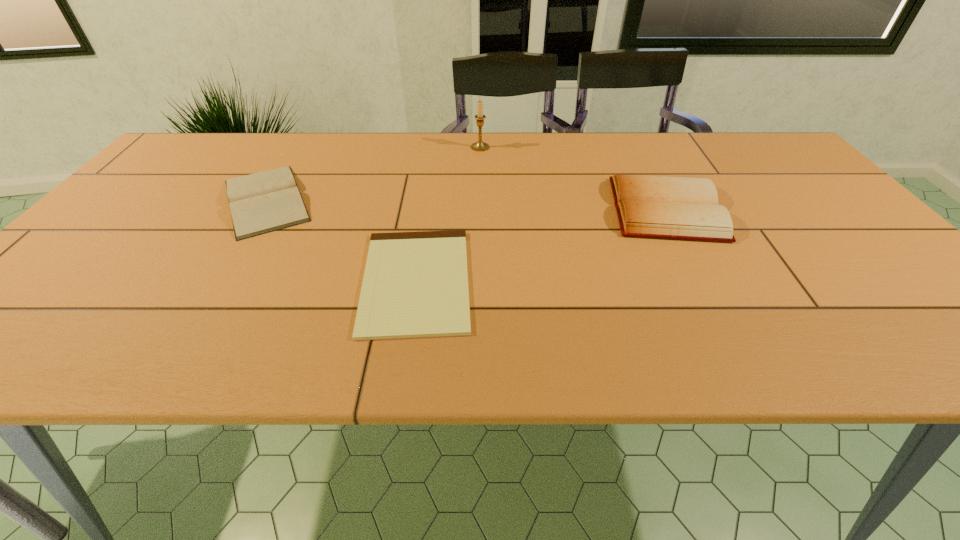
This screenshot has width=960, height=540. I want to click on blank region between the left Bible and the tallest object, so click(373, 174).

Locate an element on the screen. free space between the shortest object and the tallest object is located at coordinates (448, 214).

Where is `free space between the shortest object and the farthest object`? free space between the shortest object and the farthest object is located at coordinates (448, 214).

Image resolution: width=960 pixels, height=540 pixels. In order to click on blank region between the candle holder and the leftmost object in this screenshot , I will do `click(373, 174)`.

Identify the location of blank region between the leftmost object and the clipboard. (341, 240).

You are a GUI agent. You are given a task and a screenshot of the screen. Output one action in this format:
    pyautogui.click(x=<x>, y=<y>)
    Task: Click on the vacant area between the right Bible and the shortest object
    The width and height of the screenshot is (960, 540).
    Given the screenshot: What is the action you would take?
    pyautogui.click(x=541, y=245)

Locate an element on the screen. The height and width of the screenshot is (540, 960). vacant space in between the shorter Bible and the right Bible is located at coordinates (466, 205).

Find the location of `vacant region between the left Bible and the candle holder`. vacant region between the left Bible and the candle holder is located at coordinates (373, 174).

Where is `vacant area that lies between the clipboard and the third tallest object`? This screenshot has height=540, width=960. vacant area that lies between the clipboard and the third tallest object is located at coordinates (341, 240).

Locate which object is the third closest to the second tallest object. Please provide its 2D coordinates. Your answer should be formatted as a tuple, i.e. [(x, y)], where the tuple contains the x and y coordinates of a point satisfying the conditions above.

[(263, 202)]